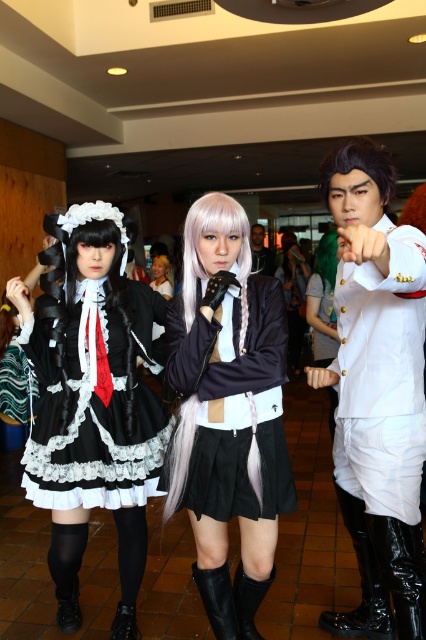
Does satin black dress at center lie in front of black leather boot at lower center?

That is True.

Is point (247, 253) positioned before point (224, 636)?

Yes, point (247, 253) is closer to viewer.

Where is `satin black dress at center`? The width and height of the screenshot is (426, 640). satin black dress at center is located at coordinates (227, 413).

Can you confirm if white glossy suit at center is positioned below black leather boot at lower right?

No.

Is white glossy suit at center wider than black leather boot at lower right?

Yes.

This screenshot has width=426, height=640. I want to click on white glossy suit at center, so click(x=377, y=392).

Between satin black dress at center and glossy patent leather boot at lower right, which one has less height?

glossy patent leather boot at lower right is shorter.

Between satin black dress at center and glossy patent leather boot at lower right, which one appears on the right side from the viewer's perspective?

Positioned to the right is glossy patent leather boot at lower right.

Measure the distance between satin black dress at center and camera.

satin black dress at center and camera are 1.64 meters apart.

Find the location of a particular element. This screenshot has height=640, width=426. satin black dress at center is located at coordinates (227, 413).